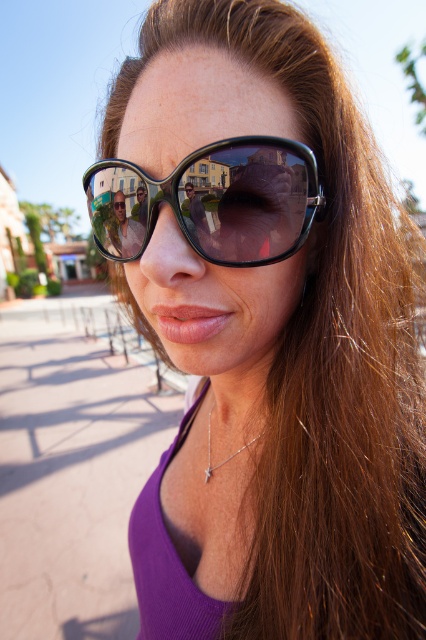
Question: Which of the following is the closest to the observer?

Choices:
 (A) (138, 250)
 (B) (290, 236)

Answer: (B)

Question: Can you confirm if black plastic sunglasses at center is smaller than matte black sunglasses at center?

Choices:
 (A) no
 (B) yes

Answer: (A)

Question: Can you confirm if black plastic sunglasses at center is thinner than matte black sunglasses at center?

Choices:
 (A) yes
 (B) no

Answer: (B)

Question: Does black plastic sunglasses at center have a smaller size compared to matte black sunglasses at center?

Choices:
 (A) yes
 (B) no

Answer: (B)

Question: Which point is closer to the camera?

Choices:
 (A) black plastic sunglasses at center
 (B) matte black sunglasses at center

Answer: (A)

Question: Which of the following is the farthest from the observer?

Choices:
 (A) (100, 228)
 (B) (129, 246)

Answer: (A)